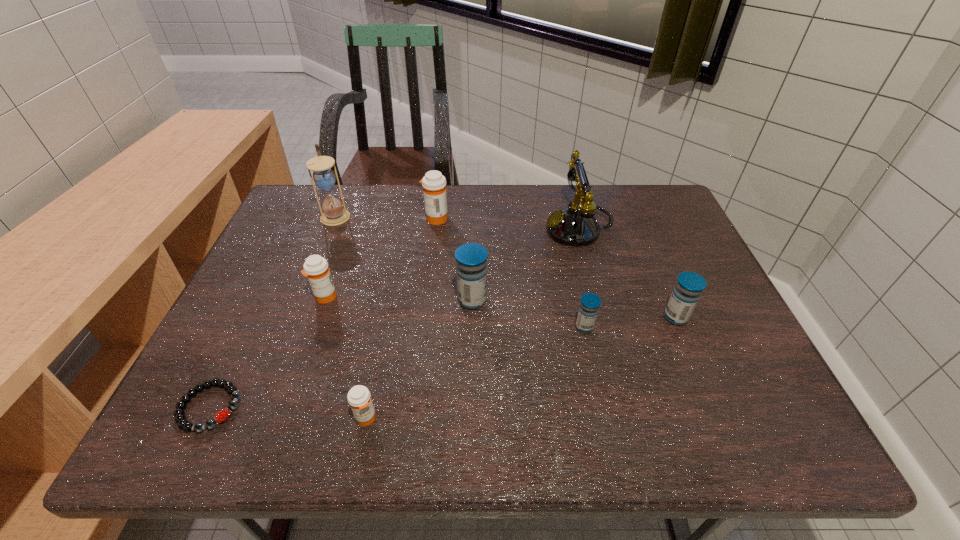
Identify the location of medicine that is at the near edge. (359, 398).

Identify the location of bracelet present at the near edge. This screenshot has width=960, height=540. (180, 418).

Where is `hourglass that is at the left edge`? This screenshot has width=960, height=540. hourglass that is at the left edge is located at coordinates (324, 177).

You are a GUI agent. You are given a task and a screenshot of the screen. Output one action in this format:
    pyautogui.click(x=<x>, y=<y>)
    Task: Click on the bracelet that is at the left edge
    The width and height of the screenshot is (960, 540).
    Given the screenshot: What is the action you would take?
    pyautogui.click(x=180, y=418)

Locate an element on the screen. The image size is (960, 540). object located at the right edge is located at coordinates (689, 286).

Where is `object situated at the far left corner`? object situated at the far left corner is located at coordinates (324, 177).

Image resolution: width=960 pixels, height=540 pixels. I want to click on object present at the near left corner, so click(180, 418).

This screenshot has height=540, width=960. I want to click on vacant space at the far edge of the desktop, so coord(450,193).

Where is `vacant space at the near edge of the desktop`? The image size is (960, 540). vacant space at the near edge of the desktop is located at coordinates (644, 415).

In the image, there is a desktop. What are the coordinates of `vacant space at the left edge` in the screenshot? It's located at (249, 315).